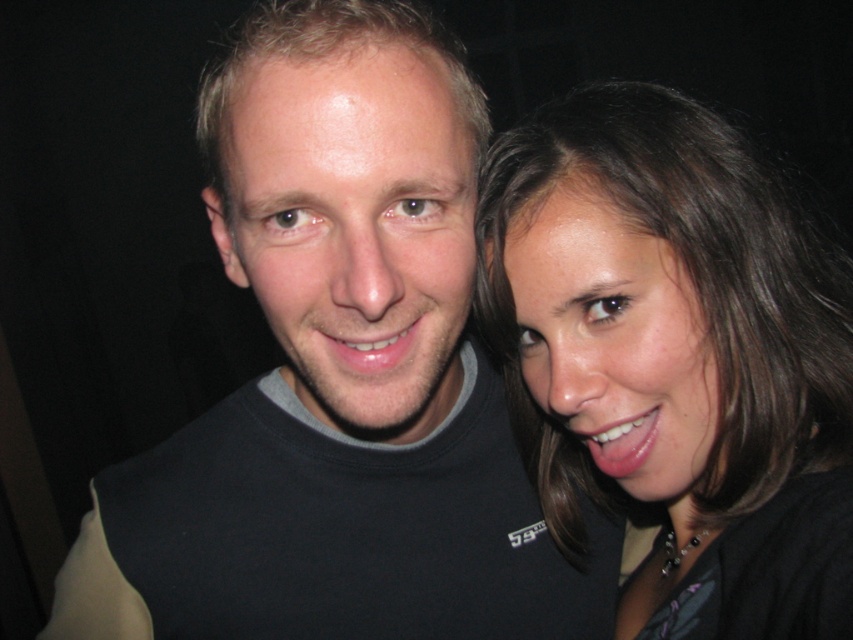
The height and width of the screenshot is (640, 853). I want to click on black matte t-shirt at center, so click(x=337, y=376).

Which is behind, point (236, 394) or point (596, 433)?

The point (236, 394) is more distant.

This screenshot has height=640, width=853. I want to click on black matte t-shirt at center, so click(337, 376).

Is black matte t-shirt at center to the right of smooth brown hair at right from the viewer's perspective?

In fact, black matte t-shirt at center is to the left of smooth brown hair at right.

Between black matte t-shirt at center and smooth brown hair at right, which one appears on the right side from the viewer's perspective?

Positioned to the right is smooth brown hair at right.

What are the coordinates of `black matte t-shirt at center` in the screenshot? It's located at (337, 376).

You are a GUI agent. You are given a task and a screenshot of the screen. Output one action in this format:
    pyautogui.click(x=<x>, y=<y>)
    Task: Click on the black matte t-shirt at center
    Image resolution: width=853 pixels, height=640 pixels.
    Given the screenshot: What is the action you would take?
    pyautogui.click(x=337, y=376)

Is smooth brown hair at right to the left of matte pink lips at center from the viewer's perspective?

No, smooth brown hair at right is not to the left of matte pink lips at center.

Is the position of smooth brown hair at right more distant than that of matte pink lips at center?

Yes, it is.

Between point (711, 512) and point (422, 340), which one is positioned behind?

Positioned behind is point (711, 512).

At what (x,y) coordinates should I click in order to perform the action: click on smooth brown hair at right. Please return your answer as a coordinate pair (x, y). Looking at the image, I should click on (677, 356).